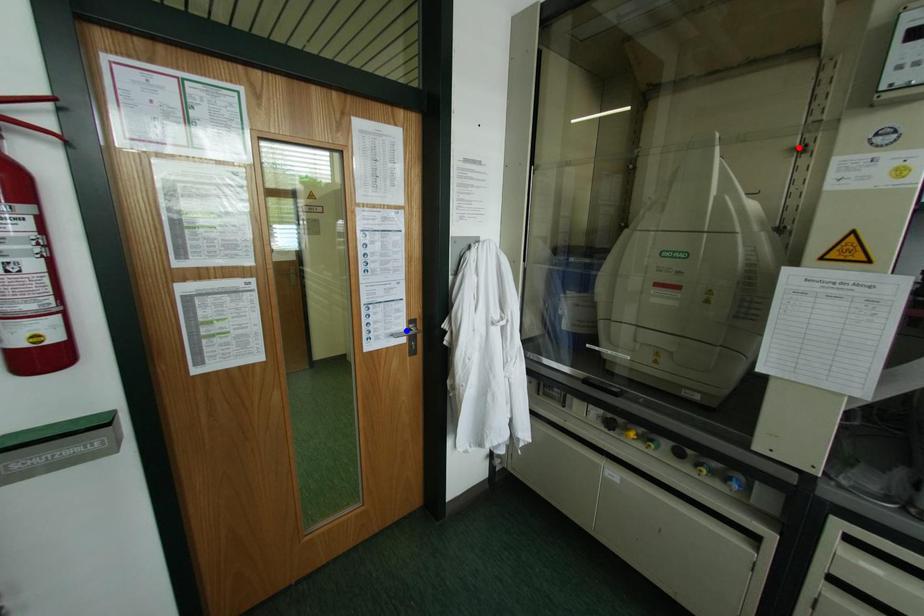
Question: Which of the two points in the image is closer to the camera?

Choices:
 (A) Blue point is closer.
 (B) Red point is closer.

Answer: (B)